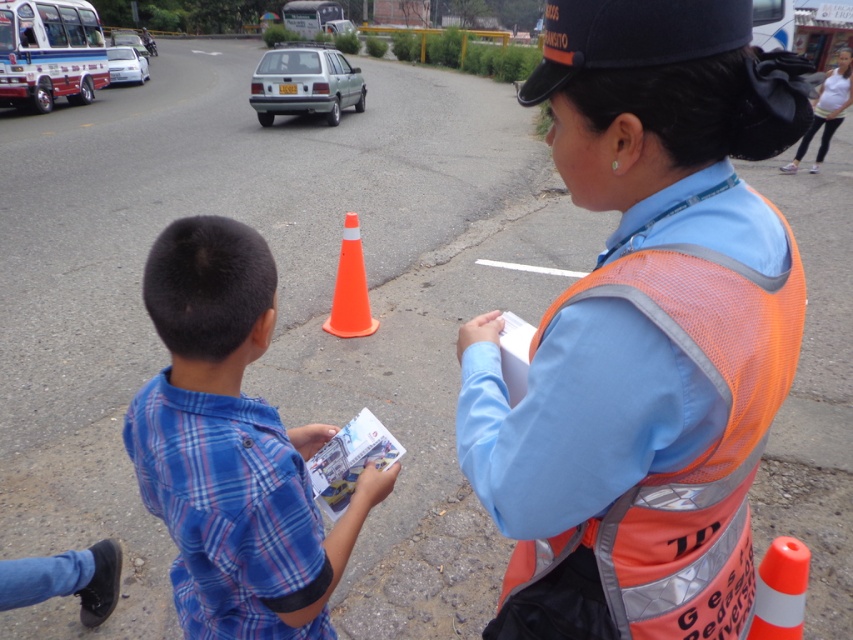
Question: Can you confirm if orange plastic traffic cone at center is positioned above white cotton shirt at upper right?

Choices:
 (A) yes
 (B) no

Answer: (B)

Question: Is orange reflective vest at center thinner than white cotton shirt at upper right?

Choices:
 (A) yes
 (B) no

Answer: (A)

Question: Which point is closer to the camera taking this photo?

Choices:
 (A) (227, 227)
 (B) (804, 147)
 (C) (766, 621)

Answer: (A)

Question: Which of the following is the farthest from the observer?

Choices:
 (A) white cotton shirt at upper right
 (B) blue plaid shirt at center

Answer: (B)

Question: From the image, what is the correct spatial relationship of blue plaid shirt at center in relation to white cotton shirt at upper right?

Choices:
 (A) below
 (B) above

Answer: (A)

Question: Which point is closer to the camera taking this photo?

Choices:
 (A) (575, 86)
 (B) (357, 317)

Answer: (A)